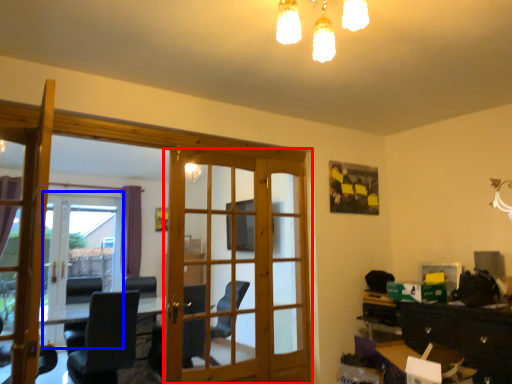
Question: Which object appears farthest to the camera in this image, door (highlighted by a red box) or screen door (highlighted by a blue box)?

Choices:
 (A) door
 (B) screen door

Answer: (B)